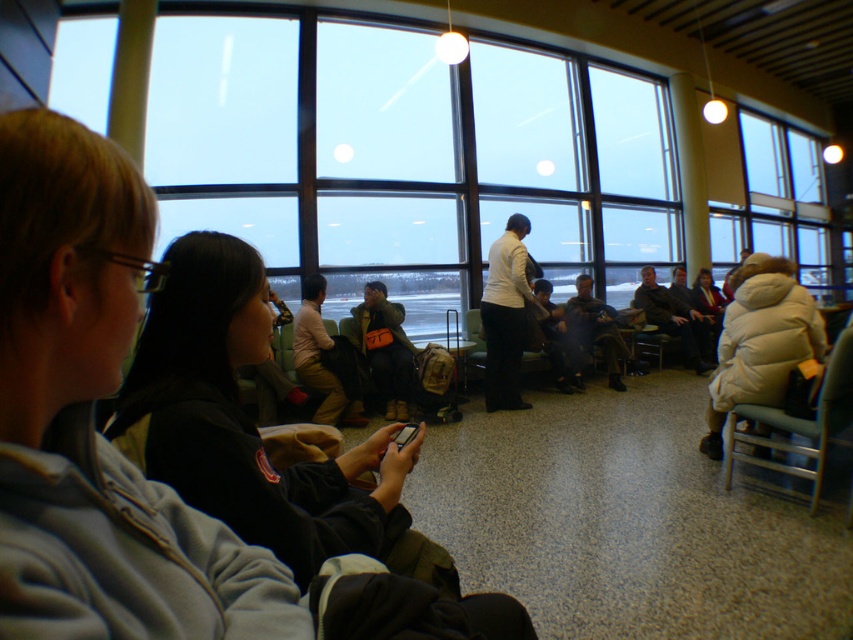
Question: Which point appears closest to the camera in this image?

Choices:
 (A) (525, 284)
 (B) (637, 298)
 (C) (787, 413)
 (D) (401, 369)

Answer: (C)

Question: Can you confirm if white puffy coat at right is positioned to the right of dark gray fabric jacket at center?

Choices:
 (A) yes
 (B) no

Answer: (A)

Question: Which object is positioned closest to the white matte jacket at center?

Choices:
 (A) camouflage fabric jacket at center
 (B) khaki cotton pants at center
 (C) light beige fabric chair at right
 (D) dark gray fabric jacket at center

Answer: (A)

Question: Which object is farther from the camera taking this photo?

Choices:
 (A) white puffy coat at center
 (B) white puffy coat at right
 (C) white matte jacket at center
 (D) camouflage fabric jacket at center

Answer: (A)

Question: Observing the image, what is the correct spatial positioning of khaki cotton pants at center in reference to white puffy coat at center?

Choices:
 (A) right
 (B) left

Answer: (B)

Question: From the image, what is the correct spatial relationship of white puffy coat at right in relation to white matte jacket at center?

Choices:
 (A) right
 (B) left

Answer: (A)